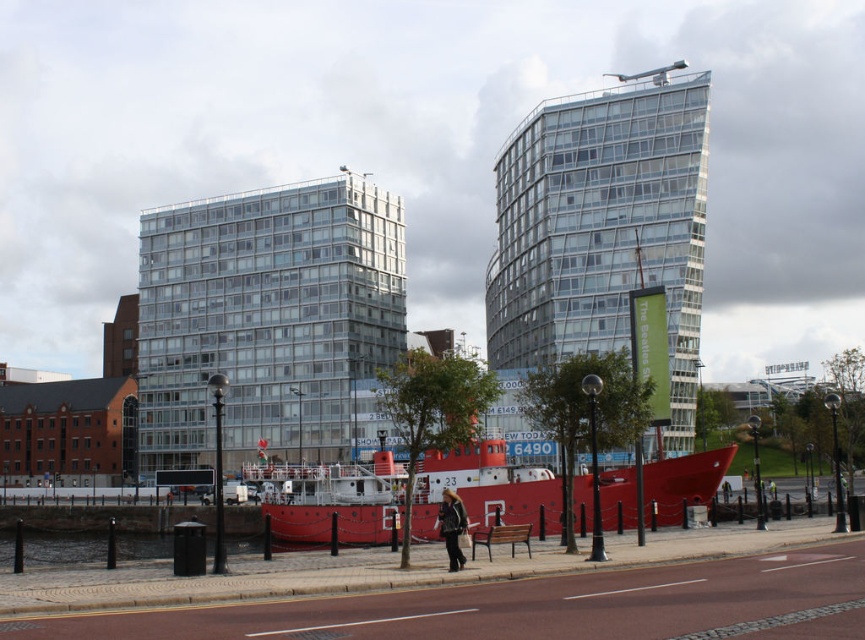
Is glassy reflective building at center bigger than metallic red boat at center?

Correct, glassy reflective building at center is larger in size than metallic red boat at center.

Who is more forward, (332, 365) or (411, 497)?

Positioned in front is point (411, 497).

Measure the distance between glassy reflective building at center and camera.

glassy reflective building at center is 105.13 meters from camera.

What are the coordinates of `glassy reflective building at center` in the screenshot? It's located at (x=266, y=320).

Based on the photo, between glassy reflective building at center and transparent glass building at upper center, which one has less height?

With less height is glassy reflective building at center.

This screenshot has width=865, height=640. In order to click on glassy reflective building at center in this screenshot , I will do `click(266, 320)`.

Find the location of a particular element. glassy reflective building at center is located at coordinates (266, 320).

Who is positioned more to the right, transparent glass building at upper center or metallic red boat at center?

Positioned to the right is transparent glass building at upper center.

Does transparent glass building at upper center have a larger size compared to metallic red boat at center?

Correct, transparent glass building at upper center is larger in size than metallic red boat at center.

You are a GUI agent. You are given a task and a screenshot of the screen. Output one action in this format:
    pyautogui.click(x=<x>, y=<y>)
    Task: Click on the transparent glass building at upper center
    
    Given the screenshot: What is the action you would take?
    point(601,227)